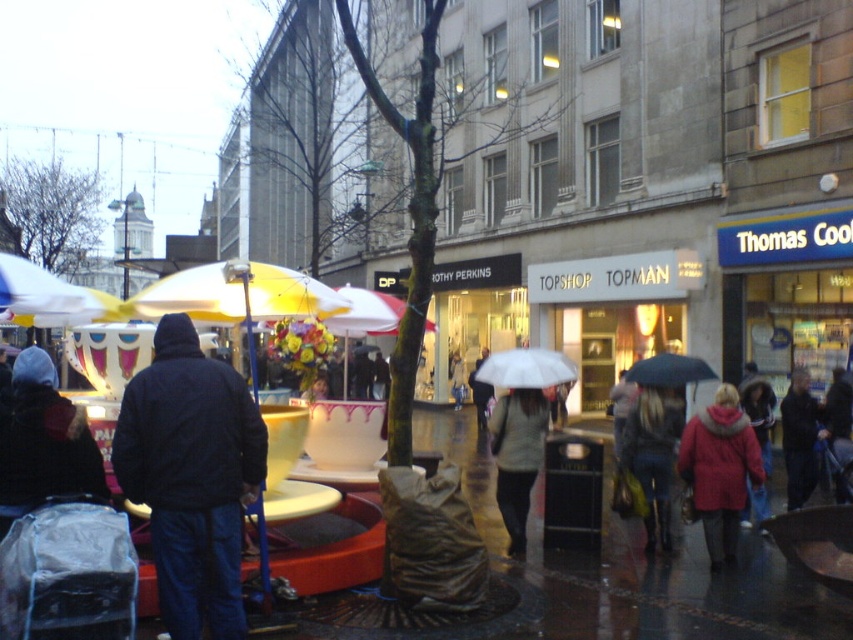
Question: Is rubberized plastic bag at lower center closer to camera compared to black matte umbrella at center?

Choices:
 (A) yes
 (B) no

Answer: (A)

Question: Which point is closer to the camera?

Choices:
 (A) rubberized plastic bag at lower center
 (B) dark blue jacket at center
 (C) black hoodie at left
 (D) transparent nylon umbrella at center

Answer: (C)

Question: Can you confirm if dark blue jacket at left is positioned above transparent nylon umbrella at center?

Choices:
 (A) yes
 (B) no

Answer: (B)

Question: Considering the real-world distances, which object is closest to the matte gray jacket at center?

Choices:
 (A) yellow matte umbrella at center
 (B) gray knit sweater at center
 (C) dark blue jacket at left
 (D) white matte umbrella at upper left

Answer: (B)

Question: Is dark blue jacket at left below yellow matte umbrella at center?

Choices:
 (A) yes
 (B) no

Answer: (A)

Question: Which of these objects is positioned farthest from the transparent nylon umbrella at center?

Choices:
 (A) black matte umbrella at center
 (B) white matte umbrella at upper left
 (C) yellow matte umbrella at center
 (D) black hoodie at left

Answer: (B)